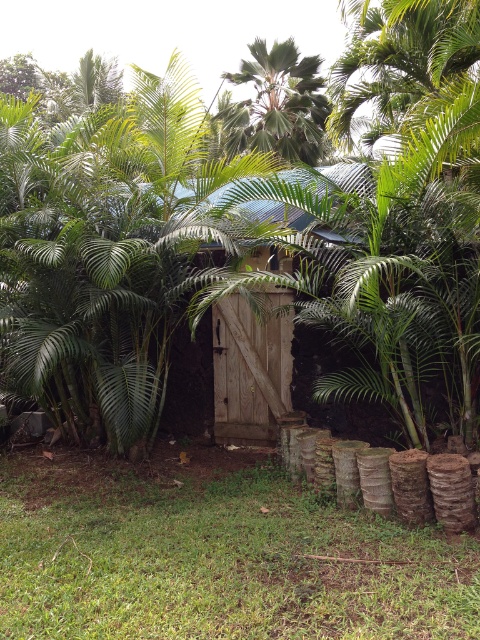
Question: Does wooden door at center lie in front of green leafy palm tree at upper center?

Choices:
 (A) no
 (B) yes

Answer: (B)

Question: Based on their relative distances, which object is nearer to the green leafy palm tree at upper center?

Choices:
 (A) wooden door at center
 (B) green leafy tree at center

Answer: (B)

Question: Which object appears farthest from the camera in this image?

Choices:
 (A) green leafy tree at center
 (B) wooden door at center
 (C) green leafy palm tree at upper center

Answer: (C)

Question: Among these points, which one is nearest to the camera?

Choices:
 (A) click(252, 52)
 (B) click(267, 419)

Answer: (B)

Question: Can you confirm if green leafy tree at center is wider than green leafy palm tree at upper center?

Choices:
 (A) no
 (B) yes

Answer: (B)

Question: Where is green leafy tree at center located in relation to green leafy palm tree at upper center in the image?

Choices:
 (A) right
 (B) left

Answer: (A)